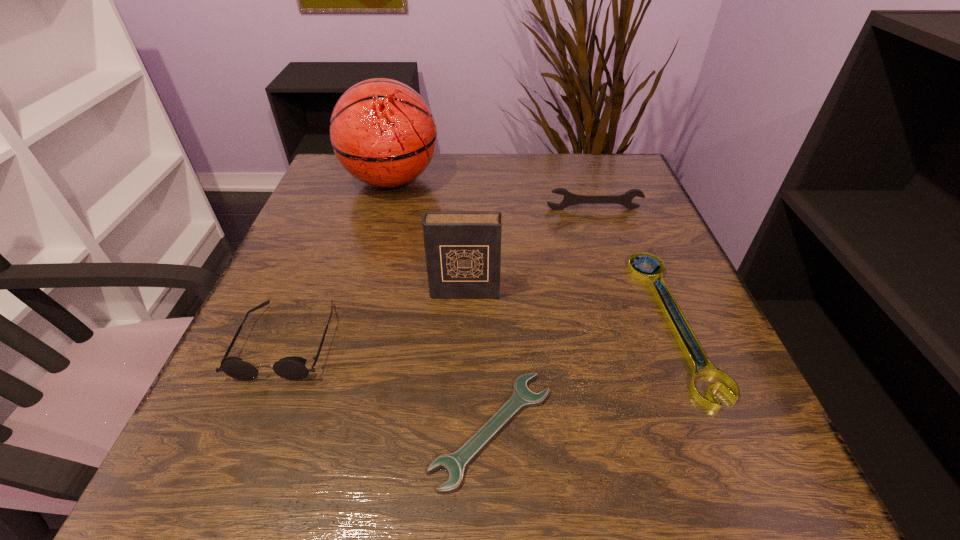
Find the location of a particular element. the tallest object is located at coordinates (383, 133).

You are a GUI agent. You are given a task and a screenshot of the screen. Output one action in this format:
    pyautogui.click(x=<x>, y=<y>)
    Task: Click on the farthest object
    This screenshot has width=960, height=540.
    Given the screenshot: What is the action you would take?
    pyautogui.click(x=383, y=133)

Identify the location of diary. This screenshot has width=960, height=540. (462, 248).

Locate an element on the screen. the tallest wrench is located at coordinates (569, 199).

Find the location of `the farthest wrench`. the farthest wrench is located at coordinates (569, 199).

The image size is (960, 540). What are the coordinates of `sunglasses` in the screenshot? It's located at (292, 368).

I want to click on the fifth tallest object, so click(x=647, y=276).

This screenshot has width=960, height=540. Identify the location of the shortest object. (454, 464).

This screenshot has width=960, height=540. In order to click on the leftmost wrench in this screenshot , I will do `click(454, 464)`.

Find the location of a particular element. Image resolution: width=960 pixels, height=540 pixels. vacant space situated 0.120m on the side with spill of the tallest object is located at coordinates (488, 180).